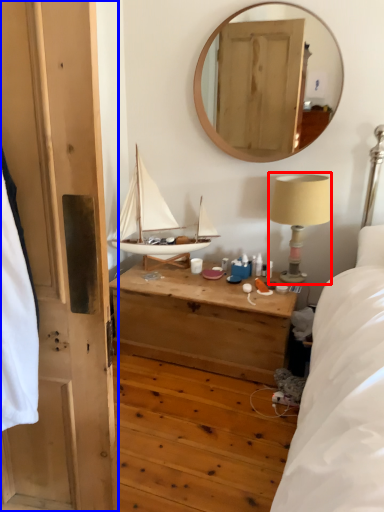
Question: Which object appears closest to the camera in this image, table lamp (highlighted by a red box) or door (highlighted by a blue box)?

Choices:
 (A) table lamp
 (B) door

Answer: (B)